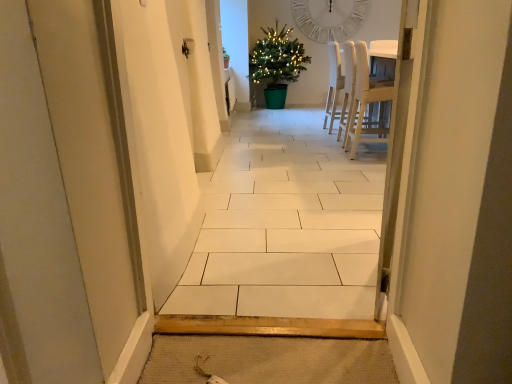
Question: In terms of width, does white wood chair at center, which is counted as the second chair, starting from the front, look wider or thinner when compared to white matte clock at upper center?

Choices:
 (A) thin
 (B) wide

Answer: (B)

Question: Is white wood chair at center, which is the first chair from back to front, inside the boundaries of white matte clock at upper center, or outside?

Choices:
 (A) inside
 (B) outside

Answer: (B)

Question: Based on their relative distances, which object is farther from the white tile floor at center?

Choices:
 (A) white wood chair at center, which is counted as the second chair, starting from the front
 (B) white matte clock at upper center
 (C) light wood chair at right, positioned as the second chair in back-to-front order
 (D) green plastic potted plant at center

Answer: (B)

Question: Which of these objects is positioned closest to the white wood chair at center, which is the first chair from back to front?

Choices:
 (A) light wood chair at right, positioned as the second chair in back-to-front order
 (B) white tile floor at center
 (C) green plastic potted plant at center
 (D) white matte clock at upper center

Answer: (A)